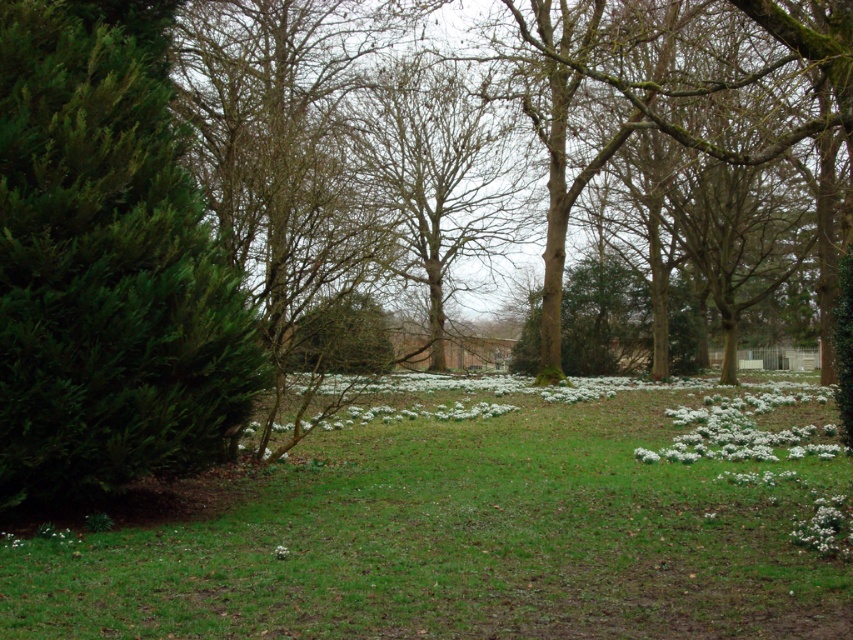
You are an artist sketching this scene and want to add more details to the white matte flowers at lower right and the white matte flower at lower right. Based on their positions, which one should you draw first if you start from the left side of the image?

You should draw the white matte flower at lower right first because it is positioned to the left of the white matte flowers at lower right.

You are standing in the middle of the grassy area and see two points in the scene. The first point is at coordinates point [33,420] and the second is at point [815,454]. Which point is closer to you?

Point [33,420] is closer to the camera than point [815,454], so the first point is closer to you.